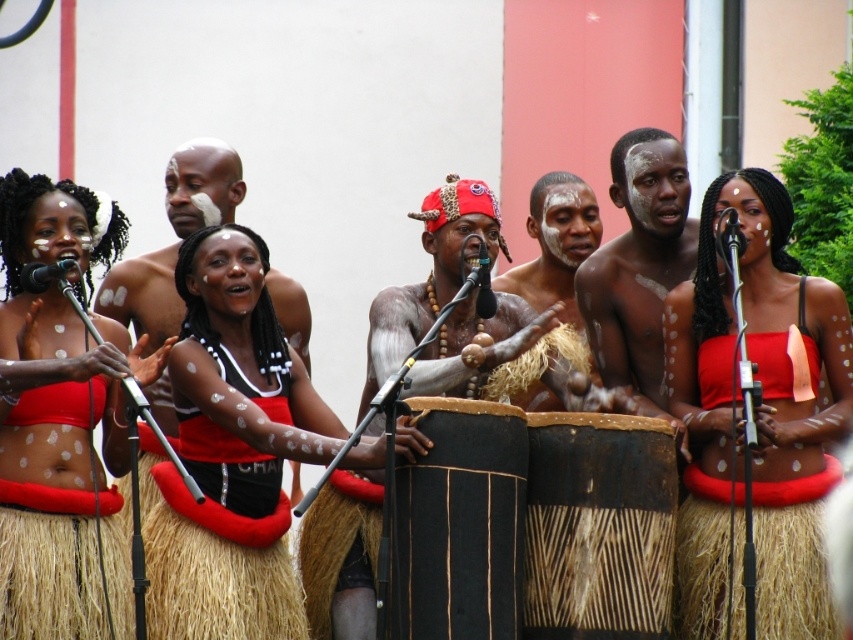
You are a photographer positioned at point A. You want to capture a photo of the performer in the center without any obstructions. There are two points marked in the scene, point A at coordinates point A is at point A. Wait, the objects are points. Hmm, the objects are two points. The question should involve those points. The scene has a performer in the center with a drum. The two points are coordinates. The objects description says point (x=454, y=275) is behind point (x=465, y=481). So the question should be

The point at coordinates point A is behind point B, so you should position yourself at point B to avoid obstructions.

You are a stagehand setting up equipment for the performance. You need to place the natural wood drum at center and the black plastic microphone at center such that they are exactly 12 meters apart. Based on the current setup, do you need to move either the drum or the microphone to meet this requirement?

The distance between the natural wood drum at center and the black plastic microphone at center is currently 11.96 meters. Since this is slightly less than the required 12 meters, you would need to move either the drum or the microphone approximately 0.04 meters further apart to meet the requirement.

You are a photographer trying to capture the performer at the center of the scene. The photographer needs to focus on the leather cap at center. What are the coordinates where the photographer should aim the camera?

The photographer should aim the camera at coordinates point (428, 275) to focus on the leather cap at center.